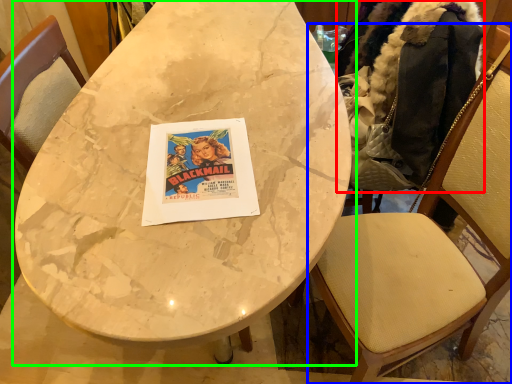
Question: Considering the real-world distances, which object is farthest from jacket (highlighted by a red box)? chair (highlighted by a blue box) or table (highlighted by a green box)?

Choices:
 (A) chair
 (B) table

Answer: (B)